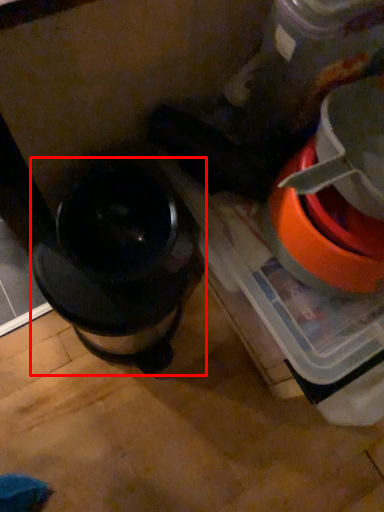
Question: From the image's perspective, what is the correct spatial positioning of kitchen appliance (annotated by the red box) in reference to appliance?

Choices:
 (A) below
 (B) above

Answer: (A)